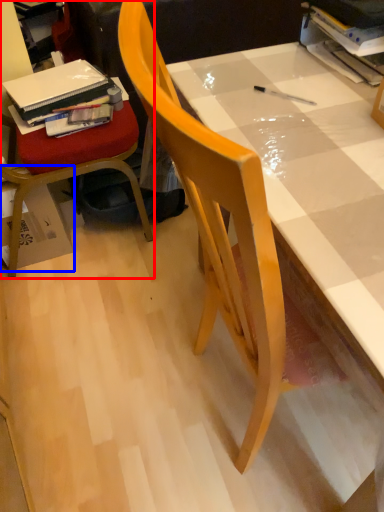
Question: Among these objects, which one is farthest to the camera, chair (highlighted by a red box) or cardboard box (highlighted by a blue box)?

Choices:
 (A) chair
 (B) cardboard box

Answer: (B)